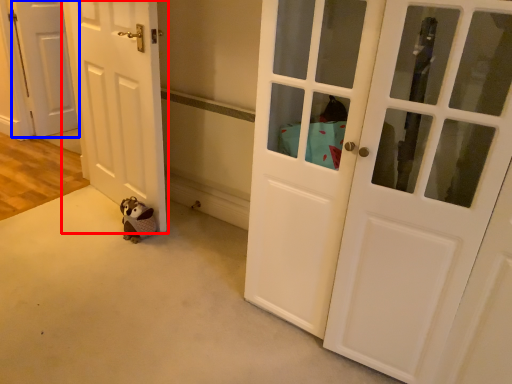
Question: Which object appears closest to the camera in this image, door (highlighted by a red box) or door (highlighted by a blue box)?

Choices:
 (A) door
 (B) door

Answer: (A)